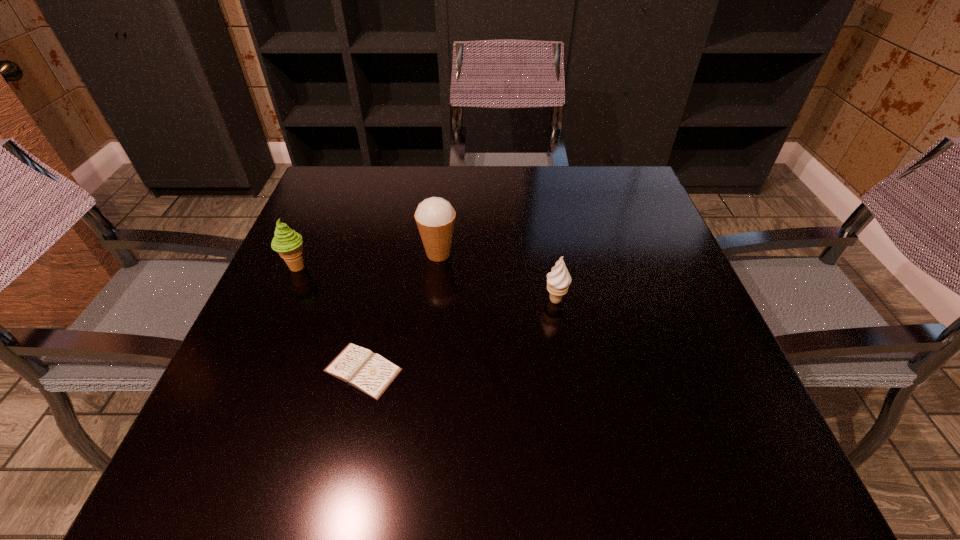
This screenshot has width=960, height=540. In order to click on vacant space that is in between the diary and the second icecream from left to right in this screenshot , I will do `click(400, 312)`.

Locate an element on the screen. The image size is (960, 540). free area in between the second icecream from left to right and the leftmost icecream is located at coordinates tap(368, 261).

Where is `unoccupied area between the leftmost object and the rightmost object`? Image resolution: width=960 pixels, height=540 pixels. unoccupied area between the leftmost object and the rightmost object is located at coordinates pyautogui.click(x=426, y=284).

Locate an element on the screen. The width and height of the screenshot is (960, 540). free area in between the nearest object and the leftmost icecream is located at coordinates (330, 319).

You are a GUI agent. You are given a task and a screenshot of the screen. Output one action in this format:
    pyautogui.click(x=<x>, y=<y>)
    Task: Click on the free space between the shortest object and the second nearest object
    The height and width of the screenshot is (540, 960).
    Given the screenshot: What is the action you would take?
    pyautogui.click(x=459, y=335)

Find the location of a particular element. The image size is (960, 540). free space that is in between the shortest object and the second icecream from right to left is located at coordinates (400, 312).

Locate which object is the second closest to the nearest object. Please provide its 2D coordinates. Your answer should be formatted as a tuple, i.e. [(x, y)], where the tuple contains the x and y coordinates of a point satisfying the conditions above.

[(435, 216)]

Choose which object is the second nearest neighbor to the shortest object. Please provide its 2D coordinates. Your answer should be formatted as a tuple, i.e. [(x, y)], where the tuple contains the x and y coordinates of a point satisfying the conditions above.

[(435, 216)]

Select which icecream is the second closest to the second icecream from left to right. Please provide its 2D coordinates. Your answer should be formatted as a tuple, i.e. [(x, y)], where the tuple contains the x and y coordinates of a point satisfying the conditions above.

[(288, 243)]

I want to click on icecream that is the second closest one to the leftmost object, so click(558, 280).